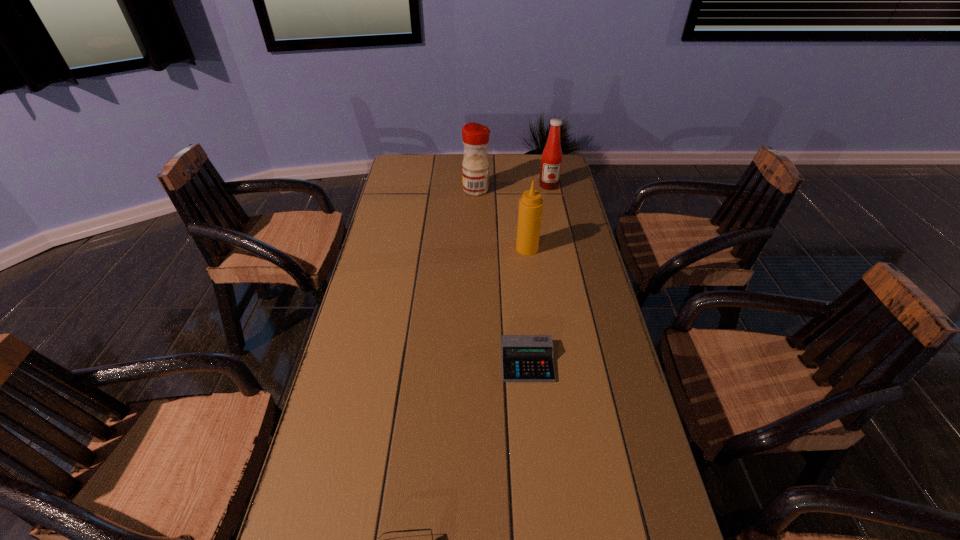
Locate an element on the screen. This screenshot has width=960, height=540. the rightmost condiment is located at coordinates (549, 178).

Locate an element on the screen. This screenshot has width=960, height=540. the leftmost condiment is located at coordinates (475, 174).

Where is `the third nearest object`? This screenshot has width=960, height=540. the third nearest object is located at coordinates (530, 211).

Where is `the second condiment from left to right`? The width and height of the screenshot is (960, 540). the second condiment from left to right is located at coordinates (530, 211).

What are the coordinates of `calculator` in the screenshot? It's located at (525, 358).

What are the coordinates of `vacant region located 0.100m on the front-facing side of the rightmost object` in the screenshot? It's located at (553, 205).

You are a GUI agent. You are given a task and a screenshot of the screen. Output one action in this format:
    pyautogui.click(x=<x>, y=<y>)
    Task: Click on the free spot located on the front of the leftmost condiment
    The height and width of the screenshot is (540, 960).
    Given the screenshot: What is the action you would take?
    pyautogui.click(x=475, y=264)

Locate an element on the screen. This screenshot has height=540, width=960. free spot located 0.220m on the front of the nearest condiment is located at coordinates (534, 303).

The image size is (960, 540). In order to click on vacant region located 0.120m on the left of the calculator in this screenshot , I will do `click(456, 362)`.

Image resolution: width=960 pixels, height=540 pixels. Identify the location of object present at the far edge. (549, 178).